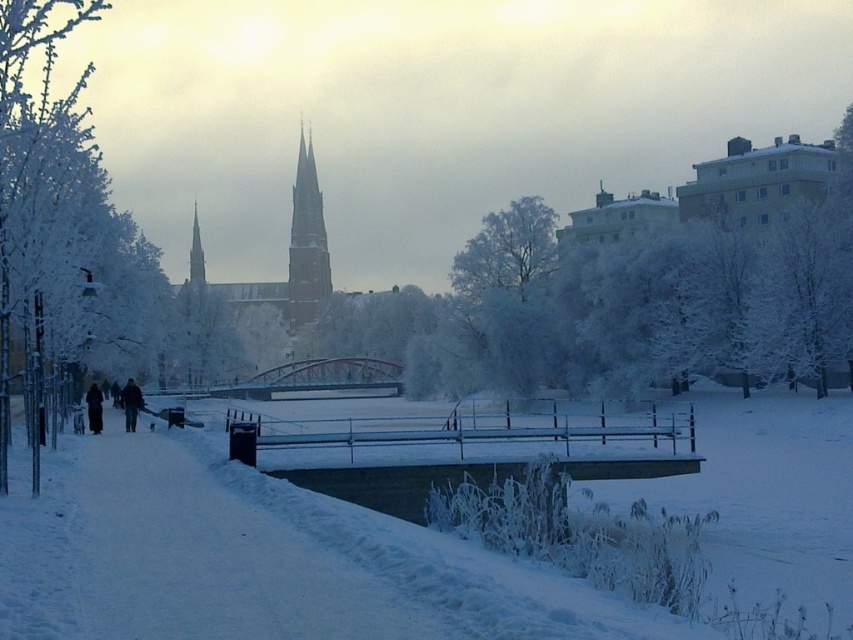
Between white frosted tree at left and metallic bridge at center, which one is positioned higher?

white frosted tree at left is above.

Which is in front, point (25, 244) or point (386, 362)?

Point (25, 244) is in front.

The image size is (853, 640). Identify the location of white frosted tree at left. (62, 221).

Does white frosty snow at center have a lesser height compared to metallic bridge at center?

Correct, white frosty snow at center is not as tall as metallic bridge at center.

Is white frosty snow at center wider than metallic bridge at center?

Indeed, white frosty snow at center has a greater width compared to metallic bridge at center.

Is point (21, 556) less distant than point (280, 369)?

Yes.

You are a GUI agent. You are given a task and a screenshot of the screen. Output one action in this format:
    pyautogui.click(x=<x>, y=<y>)
    Task: Click on the white frosty snow at center
    The width and height of the screenshot is (853, 640).
    Given the screenshot: What is the action you would take?
    pyautogui.click(x=221, y=554)

Which of these two, white frosty tree at center or white frosted tree at left, stands taller?

white frosted tree at left

Is white frosty tree at center wider than white frosted tree at left?

No.

What are the coordinates of `white frosty tree at center` in the screenshot? It's located at (654, 282).

Where is `white frosty tree at center`? white frosty tree at center is located at coordinates (654, 282).